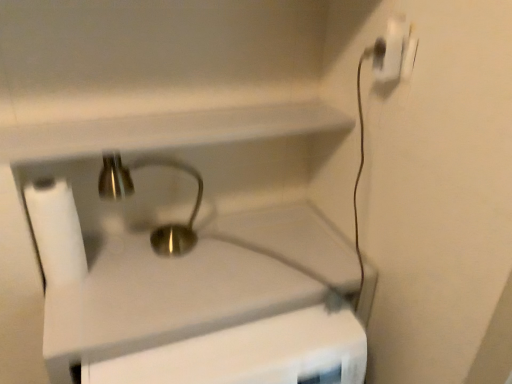
Question: Would you say white matte toilet paper at left is a long distance from brass metallic sink at center?

Choices:
 (A) yes
 (B) no

Answer: (B)

Question: From a real-world perspective, is white matte toilet paper at left physically above brass metallic sink at center?

Choices:
 (A) yes
 (B) no

Answer: (A)

Question: From the image's perspective, is white matte toilet paper at left on brass metallic sink at center?

Choices:
 (A) yes
 (B) no

Answer: (A)

Question: Can you confirm if white matte toilet paper at left is smaller than brass metallic sink at center?

Choices:
 (A) no
 (B) yes

Answer: (B)

Question: Is white matte toilet paper at left at the right side of brass metallic sink at center?

Choices:
 (A) yes
 (B) no

Answer: (B)

Question: In terms of size, does brass metallic sink at center appear bigger or smaller than white matte toilet paper at left?

Choices:
 (A) small
 (B) big

Answer: (B)

Question: Based on their positions, is brass metallic sink at center located to the left or right of white matte toilet paper at left?

Choices:
 (A) left
 (B) right

Answer: (B)

Question: From a real-world perspective, is brass metallic sink at center above or below white matte toilet paper at left?

Choices:
 (A) below
 (B) above

Answer: (A)

Question: Considering their positions, is brass metallic sink at center located in front of or behind white matte toilet paper at left?

Choices:
 (A) behind
 (B) front

Answer: (B)

Question: Considering the relative positions of white plastic power plug at upper right and brass metallic sink at center in the image provided, is white plastic power plug at upper right to the left or to the right of brass metallic sink at center?

Choices:
 (A) left
 (B) right

Answer: (B)

Question: Relative to brass metallic sink at center, is white plastic power plug at upper right in front or behind?

Choices:
 (A) behind
 (B) front

Answer: (A)

Question: From the image's perspective, relative to brass metallic sink at center, is white plastic power plug at upper right above or below?

Choices:
 (A) above
 (B) below

Answer: (A)

Question: From a real-world perspective, is white plastic power plug at upper right positioned above or below brass metallic sink at center?

Choices:
 (A) above
 (B) below

Answer: (A)

Question: Looking at their shapes, would you say white plastic power plug at upper right is wider or thinner than polished brass faucet at center?

Choices:
 (A) thin
 (B) wide

Answer: (A)

Question: From the image's perspective, is white plastic power plug at upper right positioned above or below polished brass faucet at center?

Choices:
 (A) below
 (B) above

Answer: (B)